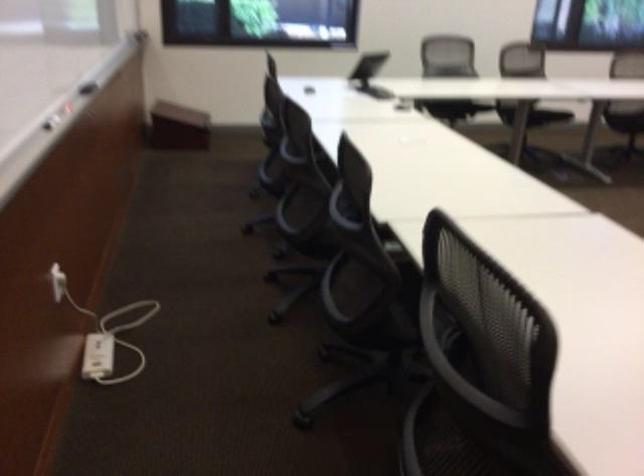
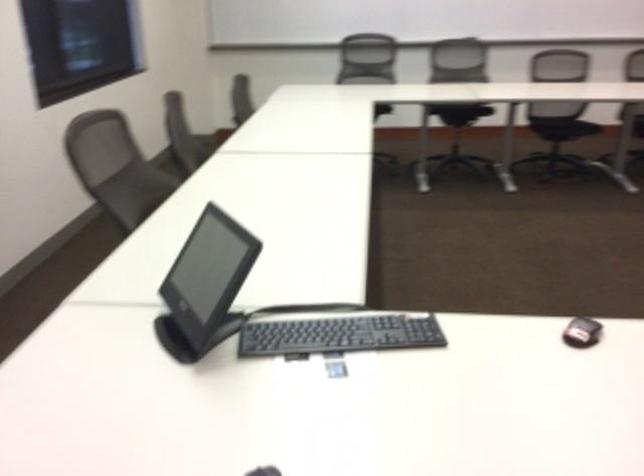
First-person continuous shooting, in which direction is the camera rotating?

The rotation direction of the camera is right-down.